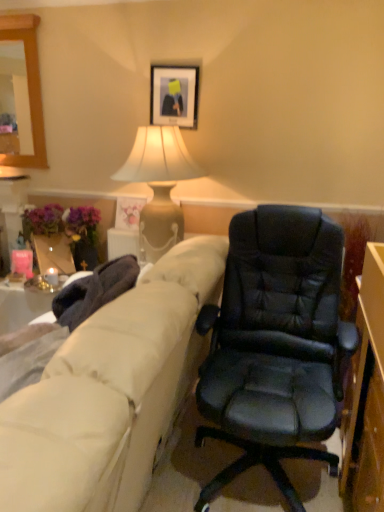
Question: Considering the positions of matte floral print picture frame at upper center, acting as the 1th picture frame starting from the left, and black leather chair at center in the image, is matte floral print picture frame at upper center, acting as the 1th picture frame starting from the left, taller or shorter than black leather chair at center?

Choices:
 (A) short
 (B) tall

Answer: (A)

Question: Visually, is matte floral print picture frame at upper center, the 1th picture frame in the back-to-front sequence, positioned to the left or to the right of black leather chair at center?

Choices:
 (A) left
 (B) right

Answer: (A)

Question: Estimate the real-world distances between objects in this image. Which object is farther from the black matte picture frame at upper center, placed as the first picture frame when sorted from front to back?

Choices:
 (A) matte floral print picture frame at upper center, the 2th picture frame in the top-to-bottom sequence
 (B) matte beige lamp at upper center
 (C) black leather chair at center
 (D) beige fabric couch at left

Answer: (D)

Question: Which object is the closest to the beige fabric couch at left?

Choices:
 (A) black leather chair at center
 (B) matte beige lamp at upper center
 (C) black matte picture frame at upper center, placed as the first picture frame when sorted from front to back
 (D) matte floral print picture frame at upper center, the 2th picture frame in the top-to-bottom sequence

Answer: (A)